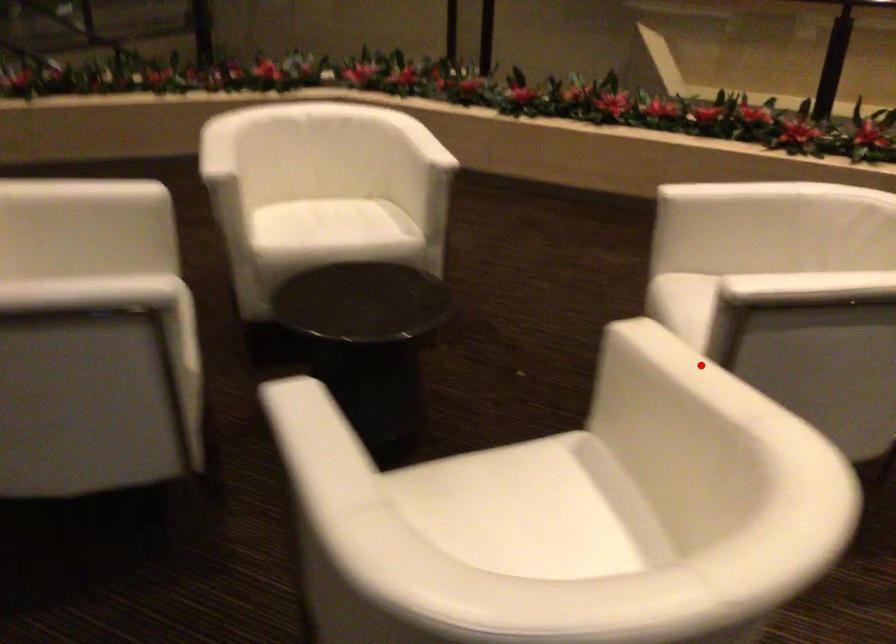
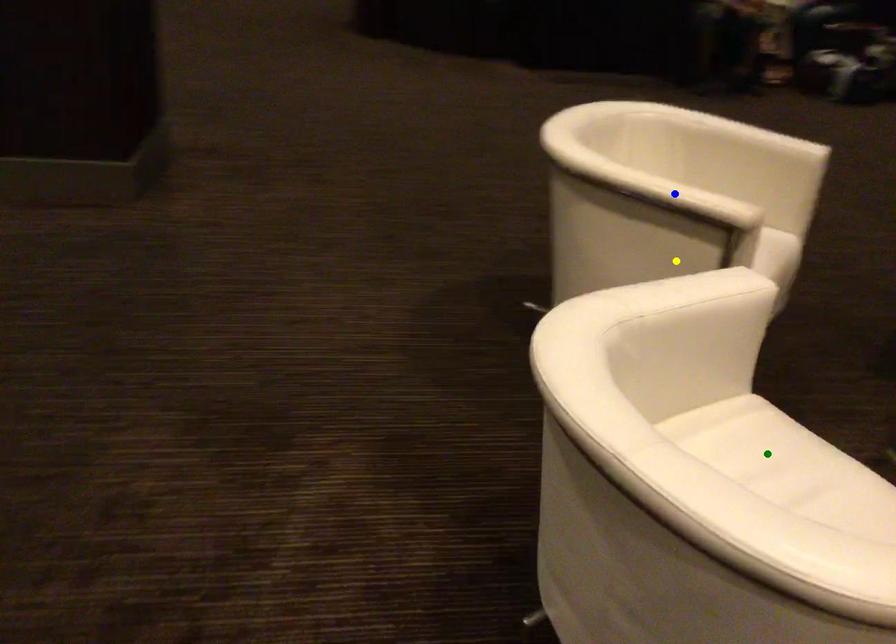
Question: I am providing you with two images of the same scene from different viewpoints. A red point is marked on the first image. You are given multiple points on the second image. Which point in image 2 is actually the same real-world point as the red point in image 1?

Choices:
 (A) yellow point
 (B) blue point
 (C) green point

Answer: (B)